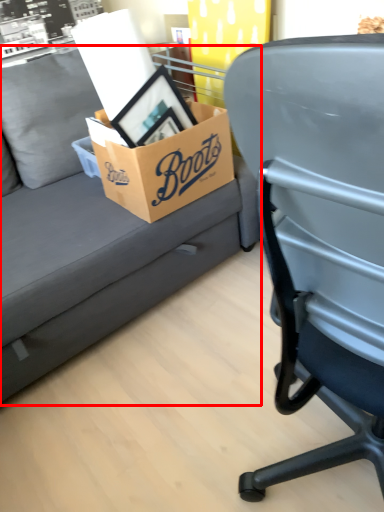
Question: From the image's perspective, considering the relative positions of studio couch (annotated by the red box) and box in the image provided, where is studio couch (annotated by the red box) located with respect to the staircase?

Choices:
 (A) above
 (B) below

Answer: (B)